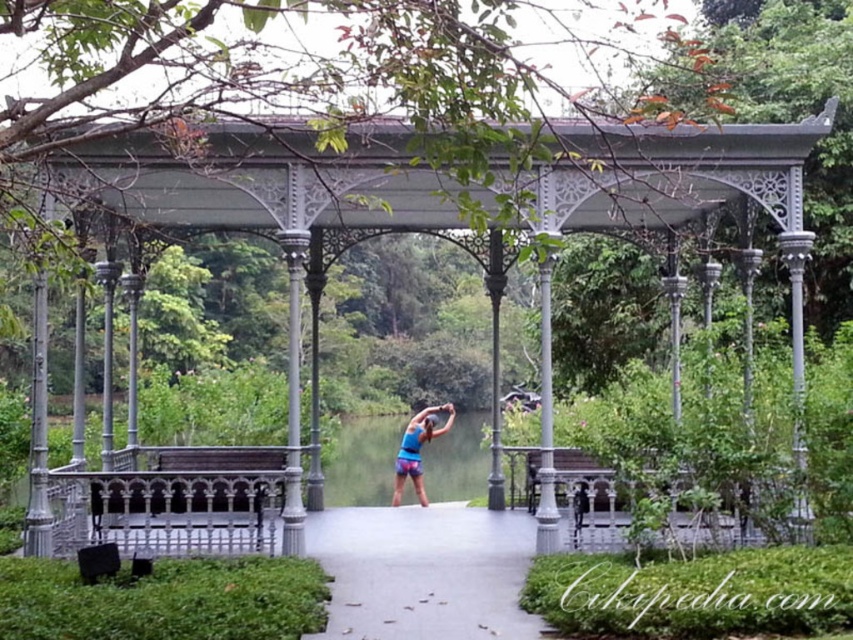
Is point (405, 211) behind point (360, 593)?

That is True.

In the scene shown: Between metallic gazebo at center and gray concrete path at center, which one has less height?

With less height is gray concrete path at center.

Who is more forward, (660, 163) or (459, 540)?

Point (660, 163)

This screenshot has height=640, width=853. In order to click on metallic gazebo at center in this screenshot , I will do `click(268, 211)`.

Is metallic gazebo at center taller than wooden bench at center?

No.

Between point (194, 214) and point (225, 477), which one is positioned behind?

Positioned behind is point (194, 214).

Between point (421, 212) and point (210, 481), which one is positioned in front?

Positioned in front is point (210, 481).

You are a GUI agent. You are given a task and a screenshot of the screen. Output one action in this format:
    pyautogui.click(x=<x>, y=<y>)
    Task: Click on the metallic gazebo at center
    
    Given the screenshot: What is the action you would take?
    pyautogui.click(x=268, y=211)

Does gray concrete path at center appear on the left side of wooden bench at center?

In fact, gray concrete path at center is to the right of wooden bench at center.

Does point (332, 573) lie behind point (253, 518)?

No, (332, 573) is in front of (253, 518).

The height and width of the screenshot is (640, 853). Find the location of `gray concrete path at center`. gray concrete path at center is located at coordinates (422, 572).